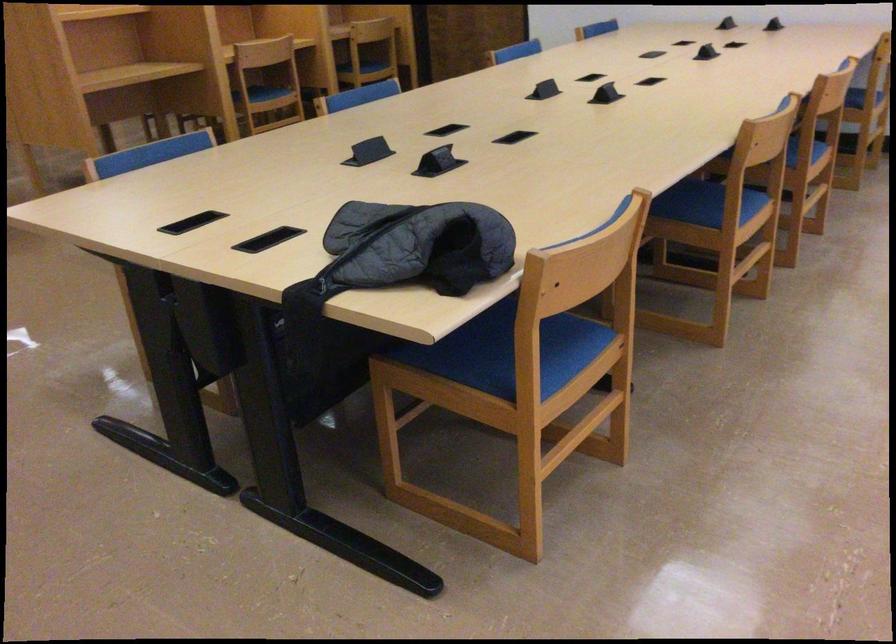
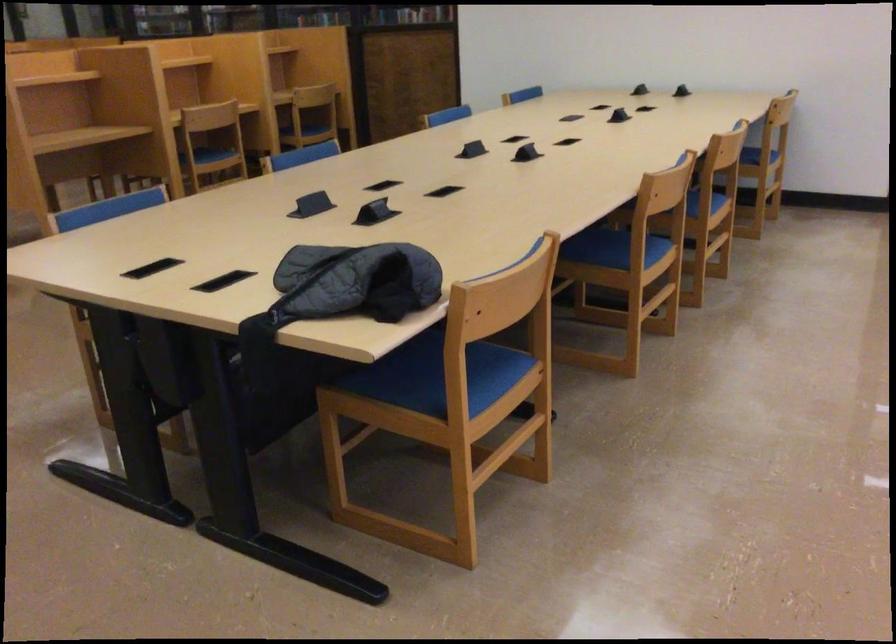
The point at (808,156) is marked in the first image. Where is the corresponding point in the second image?

(702, 207)